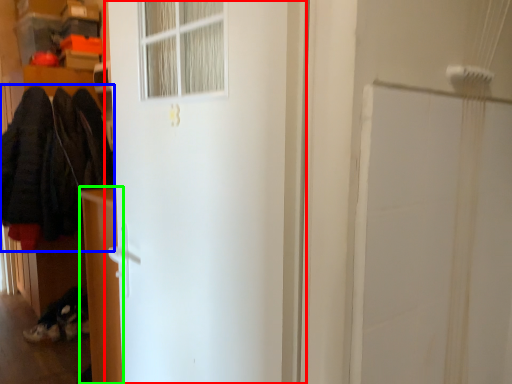
Question: Based on their relative distances, which object is nearer to door (highlighted by a red box)? Choose from clothing (highlighted by a blue box) and furniture (highlighted by a green box).

Choices:
 (A) clothing
 (B) furniture

Answer: (B)